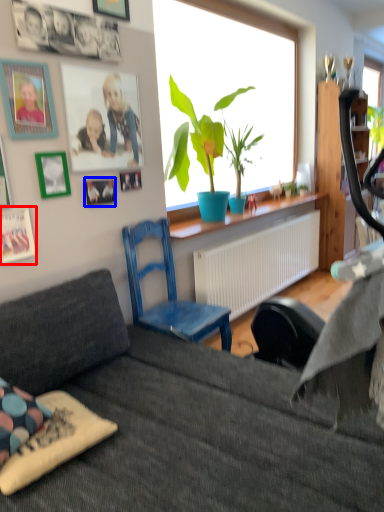
Question: Which object appears farthest to the camera in this image, picture frame (highlighted by a red box) or picture frame (highlighted by a blue box)?

Choices:
 (A) picture frame
 (B) picture frame

Answer: (B)